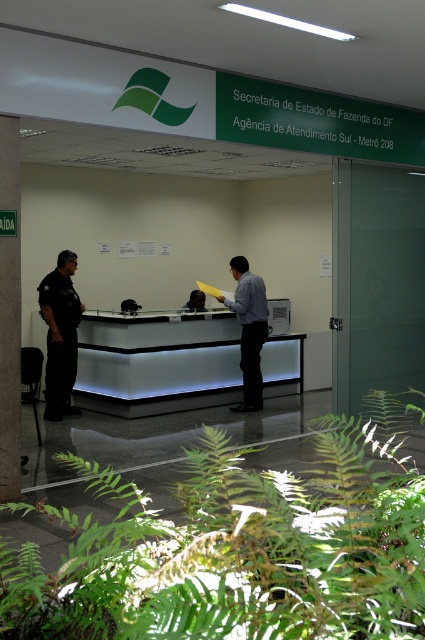
You are standing in the Secretaria de Estado de Fazenda do DF office. You see a point at coordinates (249, 330). What object or feature is located at that point?

The point at coordinates (249, 330) corresponds to the light blue shirt at center.